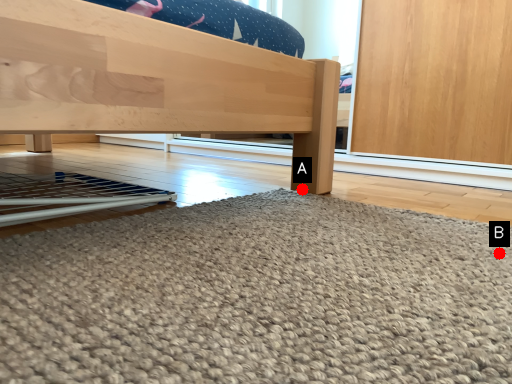
Question: Two points are circled on the image, labeled by A and B beside each circle. Which point is closer to the camera taking this photo?

Choices:
 (A) A is closer
 (B) B is closer

Answer: (B)